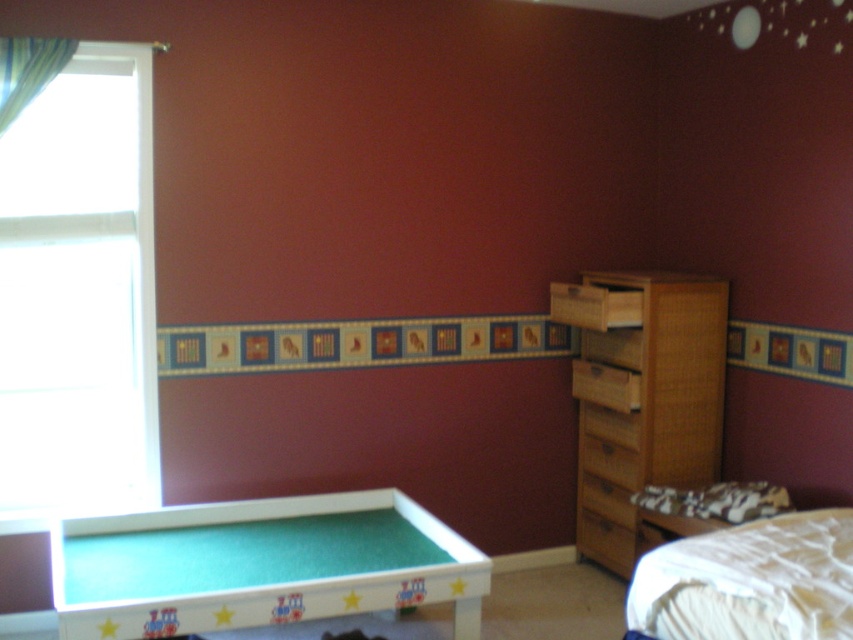
You are a parent trying to place a new rectangular bookshelf in your child room. The bookshelf is 1.5 meters wide. You want to place it along the wall where the white glass window at left and green felt billiard table at lower left are located. Can you fit the bookshelf between them without overlapping?

The white glass window at left has a width less than the green felt billiard table at lower left. Since the bookshelf is 1.5 meters wide, you need to check the combined space between them. However, without knowing the exact widths of the window and table, it is impossible to determine if the bookshelf will fit. Please measure the available space before placing the bookshelf.

You are a parent trying to place a new nightstand next to the white soft bed at lower right. The nightstand is 2 meters wide. Can you fit it there?

The distance between the white soft bed at lower right and the camera is 1.94 meters. Since the nightstand is 2 meters wide, it won there is insufficient space to fit the nightstand there.

You are standing in the center of the child bedroom. The white glass window at left is at point A. If you want to walk towards the window, which direction should you move?

Since the white glass window at left is located at point A, you should move to the left to reach it.